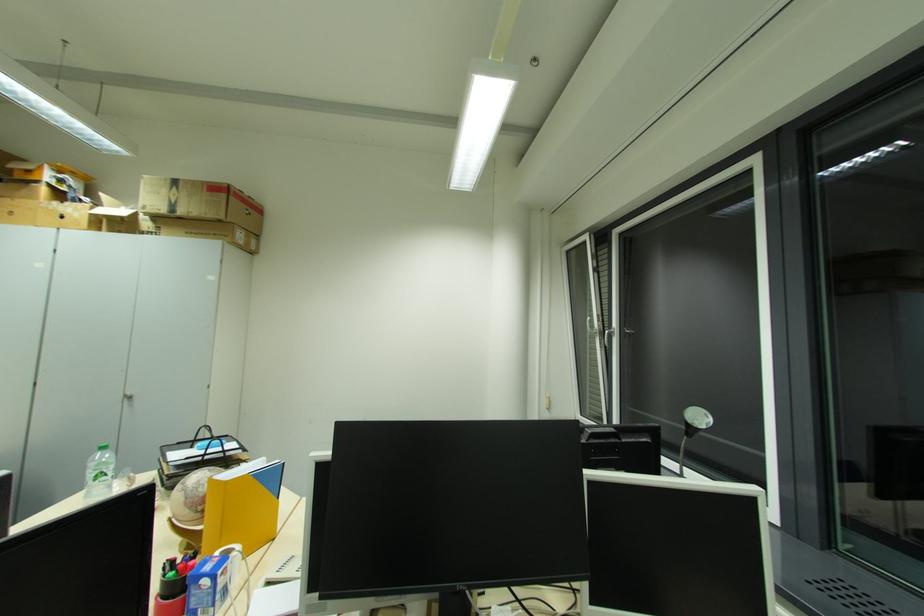
The width and height of the screenshot is (924, 616). I want to click on small desk lamp, so click(691, 429).